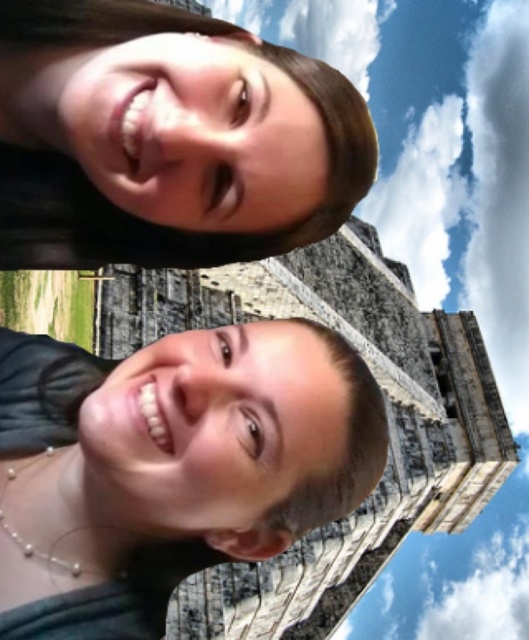
Question: Is matte black hair at center behind brown hair at upper center?

Choices:
 (A) no
 (B) yes

Answer: (A)

Question: Can you confirm if matte black hair at center is smaller than brown hair at upper center?

Choices:
 (A) yes
 (B) no

Answer: (B)

Question: Among these points, which one is nearest to the camera?

Choices:
 (A) (31, 381)
 (B) (86, 19)

Answer: (B)

Question: Does matte black hair at center appear over brown hair at upper center?

Choices:
 (A) no
 (B) yes

Answer: (A)

Question: Which point is farther from the camera taking this photo?

Choices:
 (A) (53, 44)
 (B) (252, 337)

Answer: (B)

Question: Among these objects, which one is farthest from the camera?

Choices:
 (A) matte black hair at center
 (B) brown hair at upper center

Answer: (B)